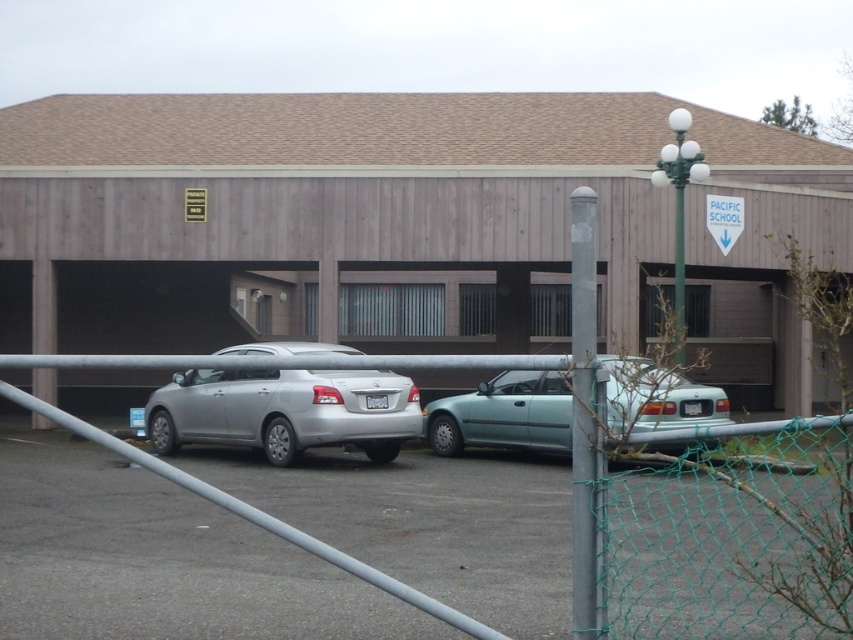
You are standing in the parking lot of PACIFIC SCHOOL and want to walk from the metal pole with a spherical lamp fixture to the small tree next to the fence. You notice two points marked on the ground at coordinates point (367,454) and point (726,244). Which point is closer to your current position near the metal pole?

Point (367,454) is closer to the viewer than point (726,244), so the point closer to your current position near the metal pole is point (367,454).

You are standing at point A located at point (375, 428) in the parking lot of PACIFIC SCHOOL. You want to walk to the entrance of the building. Since the entrance is 64.73 feet away from your current position, how many steps would you need to take if each step covers approximately 2.5 feet?

The distance between your current position at point (375, 428) and the entrance is 64.73 feet. Dividing the total distance by the step length of 2.5 feet gives 64.73 divided by 2.5 equals approximately 25.89 steps. Since you can only take whole steps, you would need to take about 26 steps to reach the entrance.